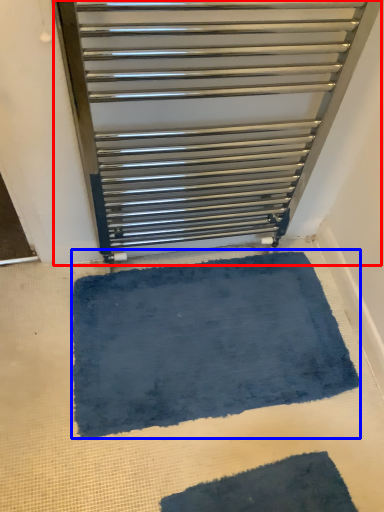
Question: Which object appears closest to the camera in this image, furniture (highlighted by a red box) or bath mat (highlighted by a blue box)?

Choices:
 (A) furniture
 (B) bath mat

Answer: (A)